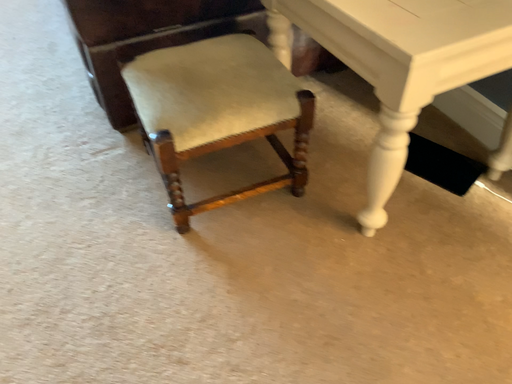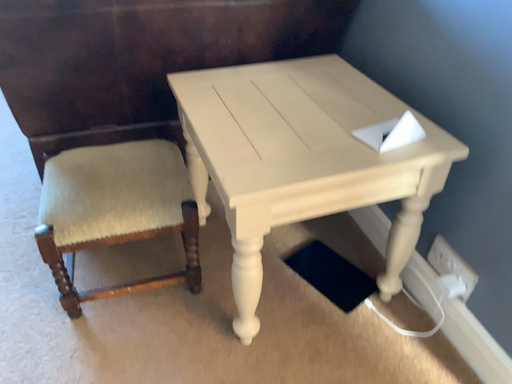
Question: How did the camera likely rotate when shooting the video?

Choices:
 (A) rotated downward
 (B) rotated upward

Answer: (B)